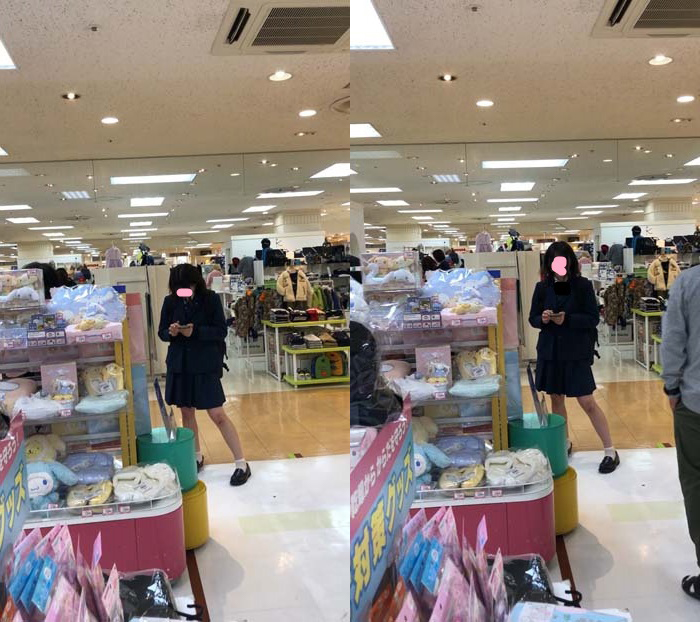
The image size is (700, 622). I want to click on light source, so click(x=162, y=175), click(x=528, y=163), click(x=148, y=202).